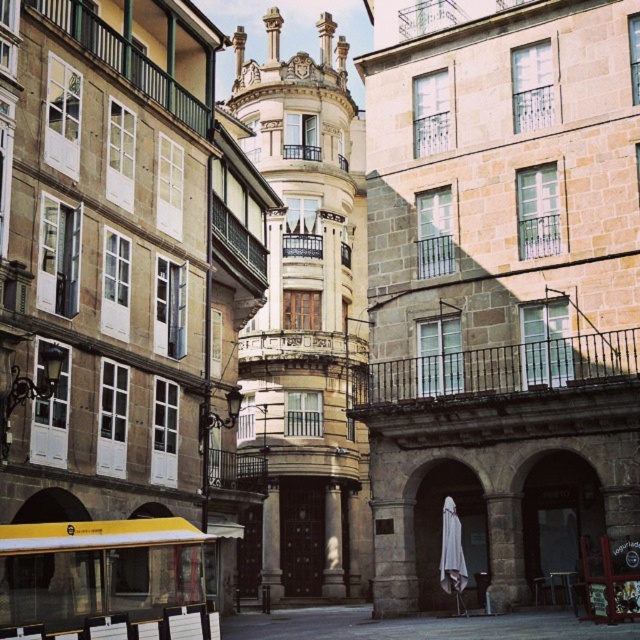
You are a visitor in this historic area and see a white cotton robe at center and a gold metallic clock at upper center. Which object is taller?

The gold metallic clock at upper center is taller than the white cotton robe at center.

You are standing in the urban scene and want to take a photo. You notice two points marked in the image. Which point, point 1 at coordinates (458,536) or point 2 at coordinates (301,61), will appear larger in your photo?

Point 1 at coordinates (458,536) will appear larger in the photo because it is closer to the camera than point 2 at coordinates (301,61).

You are a tourist standing in front of the historic buildings and notice a white cotton robe at center and a gold metallic clock at upper center. Which object is positioned higher in the image?

The gold metallic clock at upper center is positioned higher in the image than the white cotton robe at center.